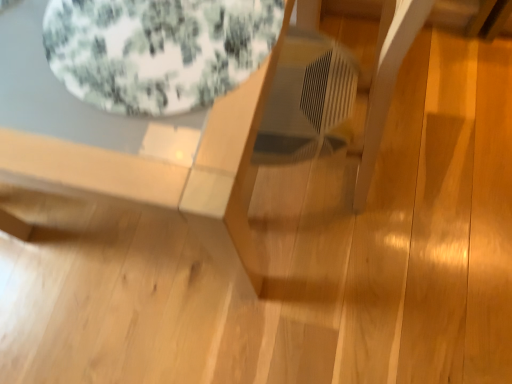
Question: In terms of size, does floral fabric bean bag at upper left appear bigger or smaller than wooden table at center?

Choices:
 (A) big
 (B) small

Answer: (B)

Question: Which is correct: floral fabric bean bag at upper left is inside wooden table at center, or outside of it?

Choices:
 (A) inside
 (B) outside

Answer: (A)

Question: In terms of width, does floral fabric bean bag at upper left look wider or thinner when compared to wooden table at center?

Choices:
 (A) thin
 (B) wide

Answer: (A)

Question: Does point (242, 94) appear closer or farther from the camera than point (217, 24)?

Choices:
 (A) farther
 (B) closer

Answer: (B)

Question: In terms of height, does wooden table at center look taller or shorter compared to floral fabric bean bag at upper left?

Choices:
 (A) short
 (B) tall

Answer: (B)

Question: Is wooden table at center inside the boundaries of floral fabric bean bag at upper left, or outside?

Choices:
 (A) inside
 (B) outside

Answer: (B)

Question: Would you say wooden table at center is to the left or to the right of floral fabric bean bag at upper left in the picture?

Choices:
 (A) left
 (B) right

Answer: (A)